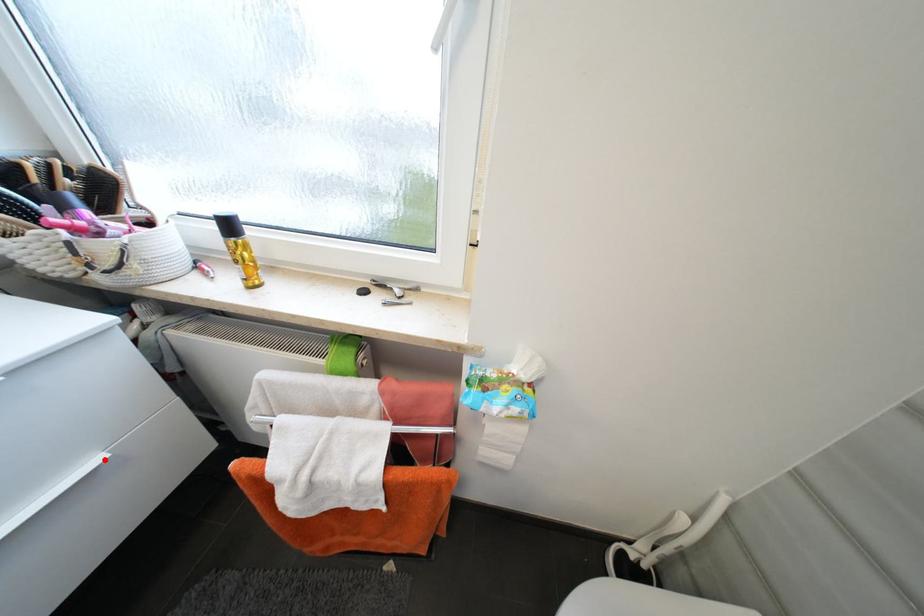
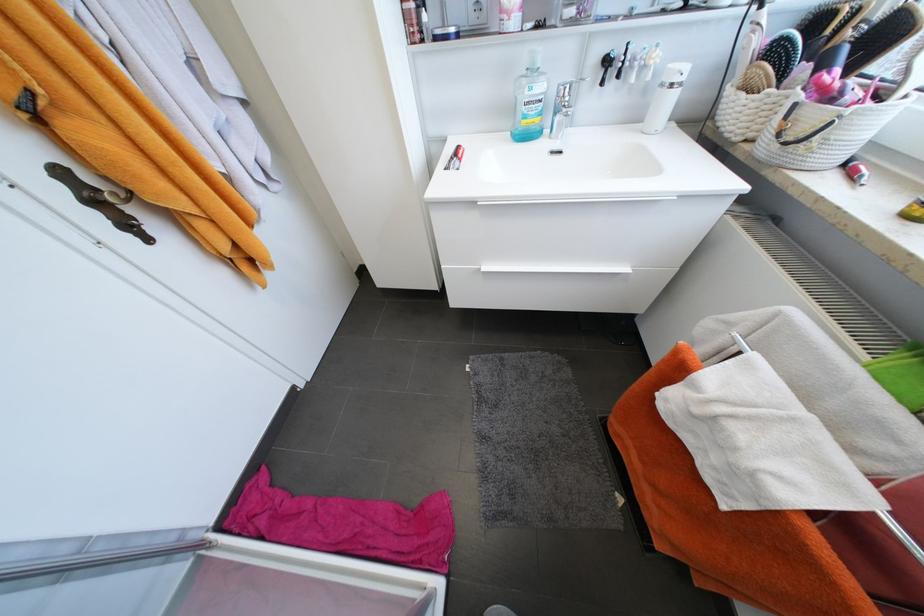
In the second image, find the point that corresponds to the highlighted location in the first image.

(631, 270)